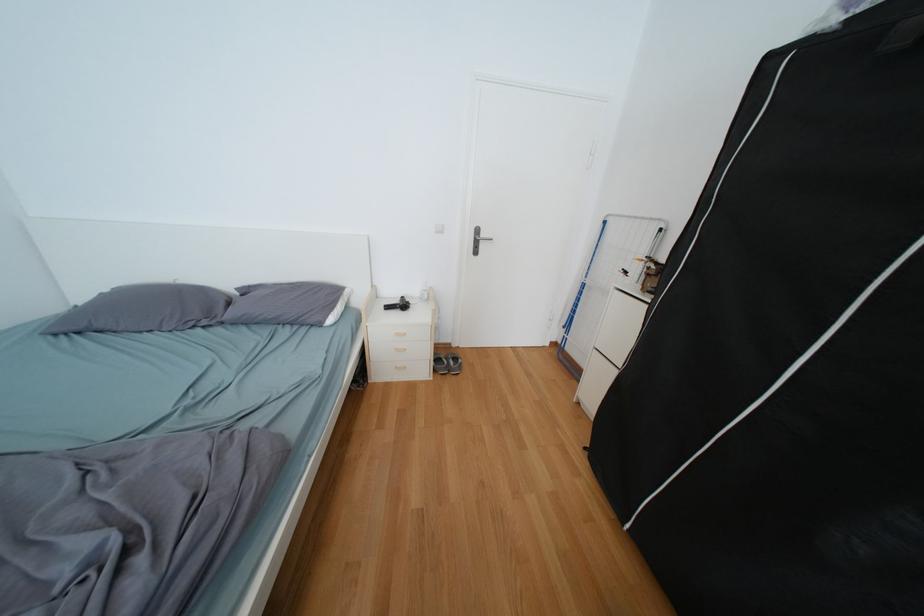
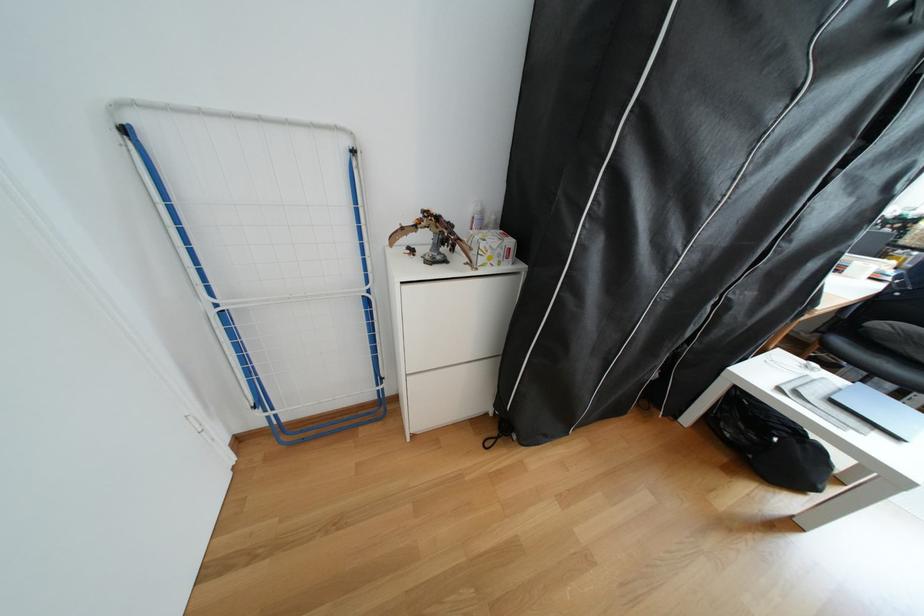
Where in the second image is the point corresponding to point (577, 328) from the first image?

(266, 408)